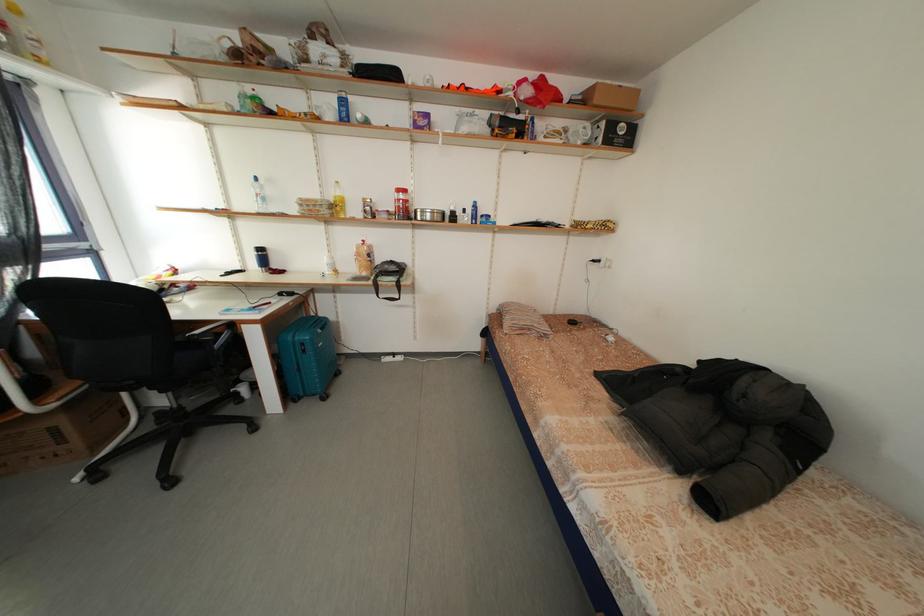
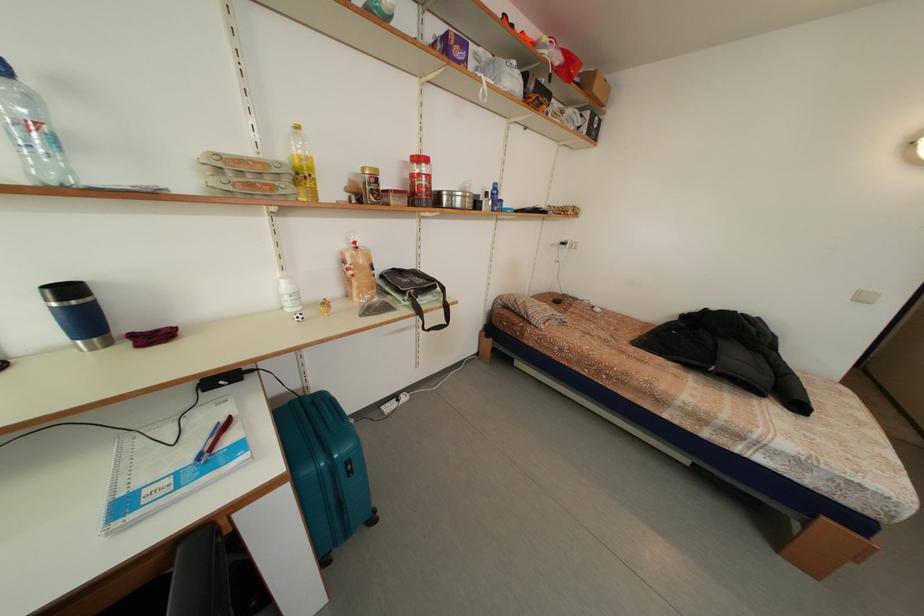
Locate, in the second image, the point that corresponds to the point at 271,193 in the first image.

(40, 106)